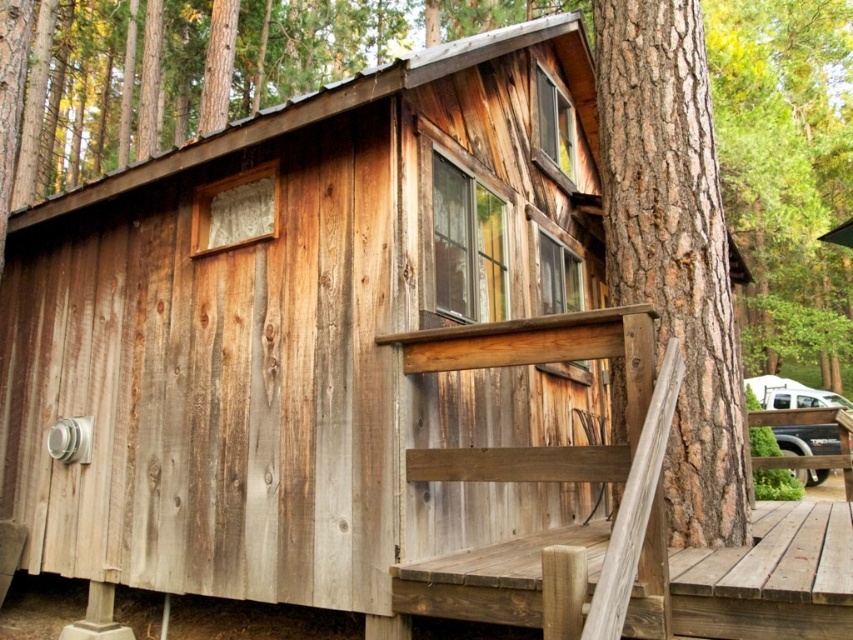
The image size is (853, 640). Find the location of `rough bark tree trunk at center`. rough bark tree trunk at center is located at coordinates (672, 246).

Who is higher up, rough bark tree trunk at center or weathered wood deck at lower right?

rough bark tree trunk at center is above.

Who is more forward, (697, 388) or (734, 602)?

Point (734, 602) is in front.

Find the location of a particular element. This screenshot has width=853, height=640. rough bark tree trunk at center is located at coordinates (672, 246).